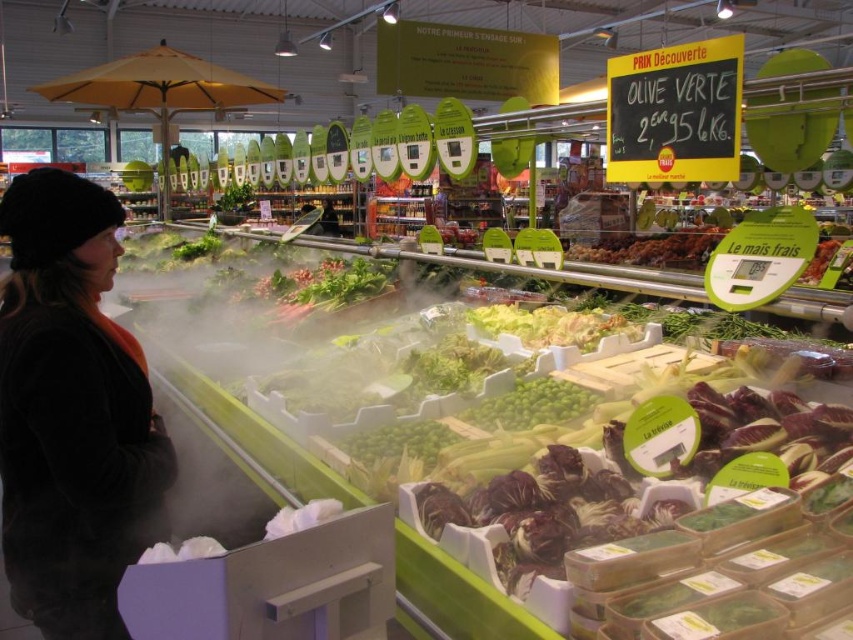
Question: Which of the following is the farthest from the observer?

Choices:
 (A) black fuzzy hat at upper left
 (B) black chalkboard at upper right

Answer: (B)

Question: Can you confirm if black fuzzy hat at upper left is bigger than black chalkboard at upper right?

Choices:
 (A) yes
 (B) no

Answer: (A)

Question: Can you confirm if black fuzzy hat at upper left is smaller than black chalkboard at upper right?

Choices:
 (A) yes
 (B) no

Answer: (B)

Question: Which point appears closest to the camera in this image?

Choices:
 (A) (80, 308)
 (B) (647, 58)

Answer: (A)

Question: Does black fuzzy hat at upper left appear under black chalkboard at upper right?

Choices:
 (A) no
 (B) yes

Answer: (B)

Question: Among these objects, which one is farthest from the camera?

Choices:
 (A) black chalkboard at upper right
 (B) black fuzzy hat at upper left

Answer: (A)